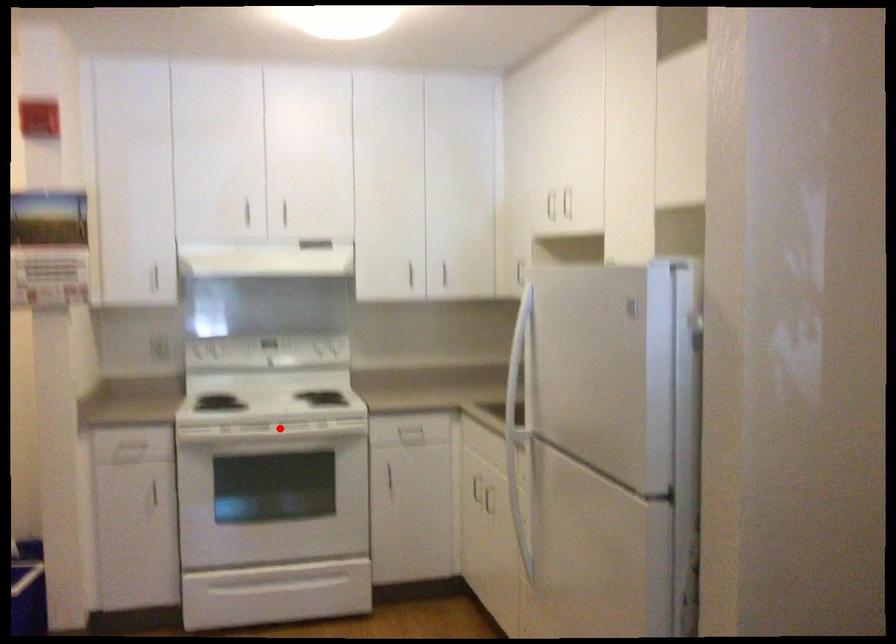
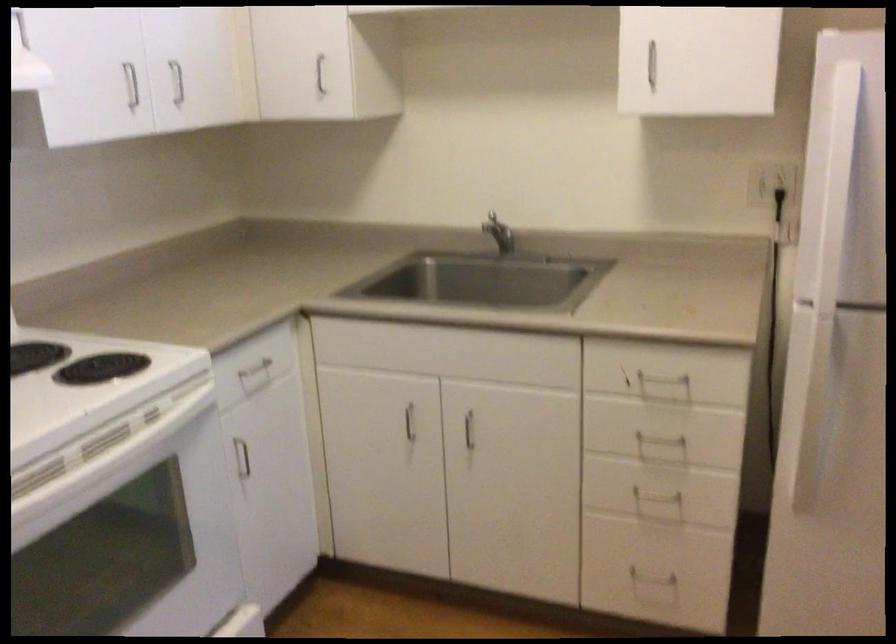
Locate, in the second image, the point that corresponds to the highlighted location in the first image.

(108, 459)